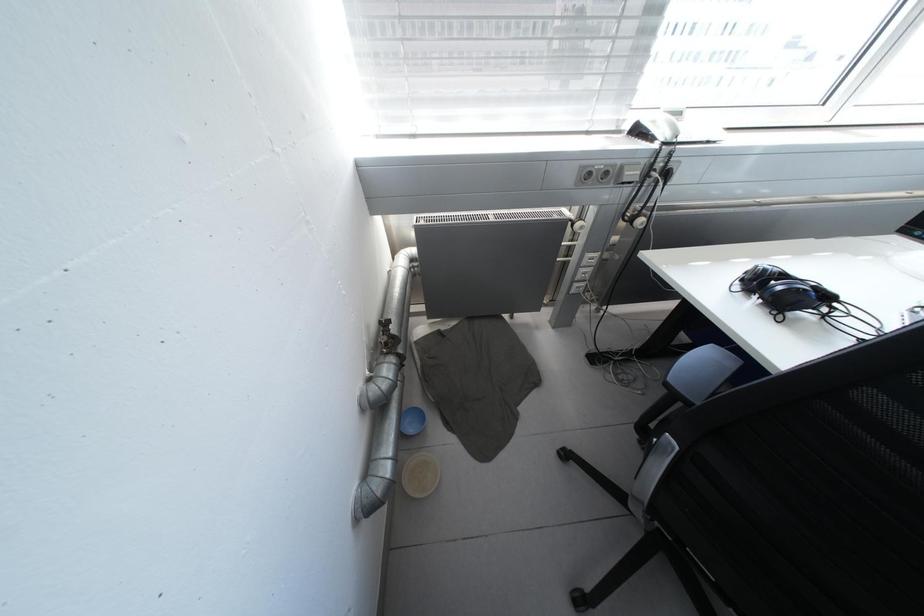
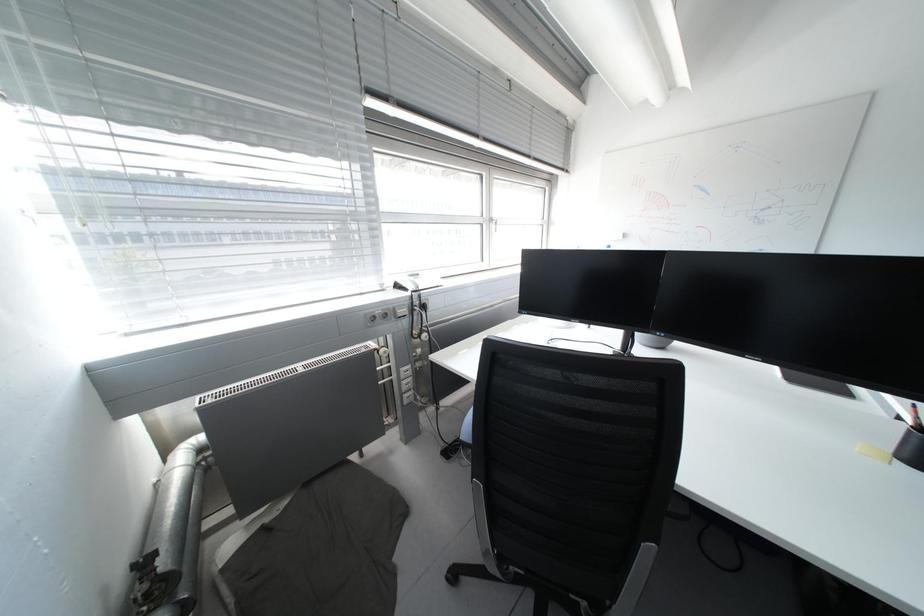
First-person continuous shooting, in which direction is the camera rotating?

The camera's rotation is toward right-up.